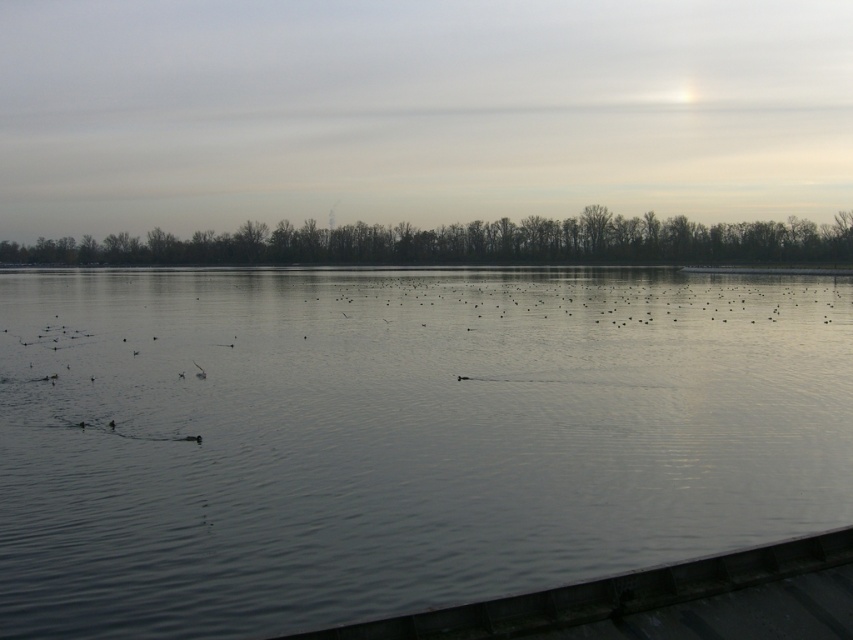
Question: Is clear water at center smaller than silhouette bare trees at upper center?

Choices:
 (A) yes
 (B) no

Answer: (A)

Question: Among these objects, which one is farthest from the camera?

Choices:
 (A) silhouette bare trees at upper center
 (B) clear water at center

Answer: (A)

Question: Which point appears farthest from the camera in this image?

Choices:
 (A) (462, 445)
 (B) (767, 234)

Answer: (B)

Question: Does clear water at center lie in front of silhouette bare trees at upper center?

Choices:
 (A) no
 (B) yes

Answer: (B)

Question: Where is clear water at center located in relation to silhouette bare trees at upper center in the image?

Choices:
 (A) left
 (B) right

Answer: (B)

Question: Among these objects, which one is nearest to the camera?

Choices:
 (A) silhouette bare trees at upper center
 (B) clear water at center

Answer: (B)